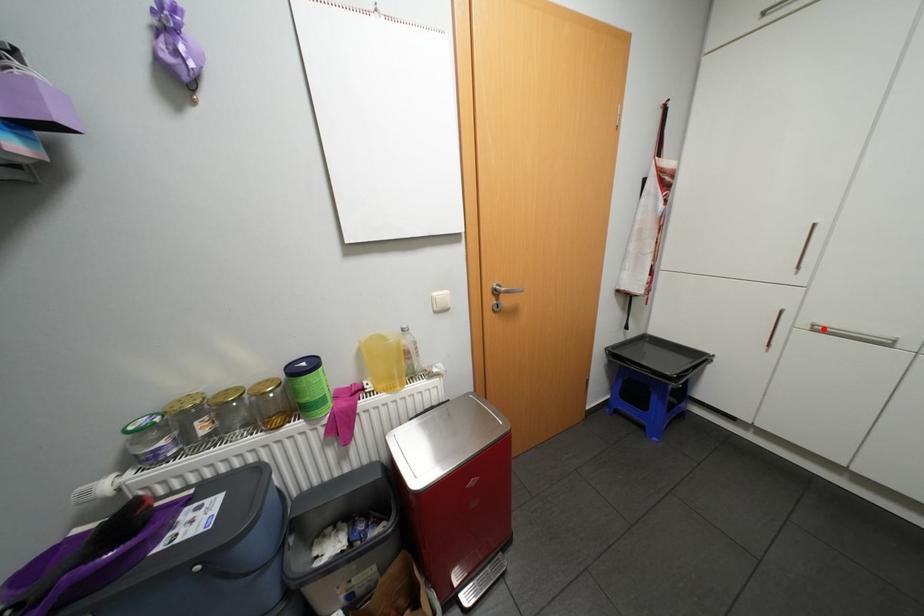
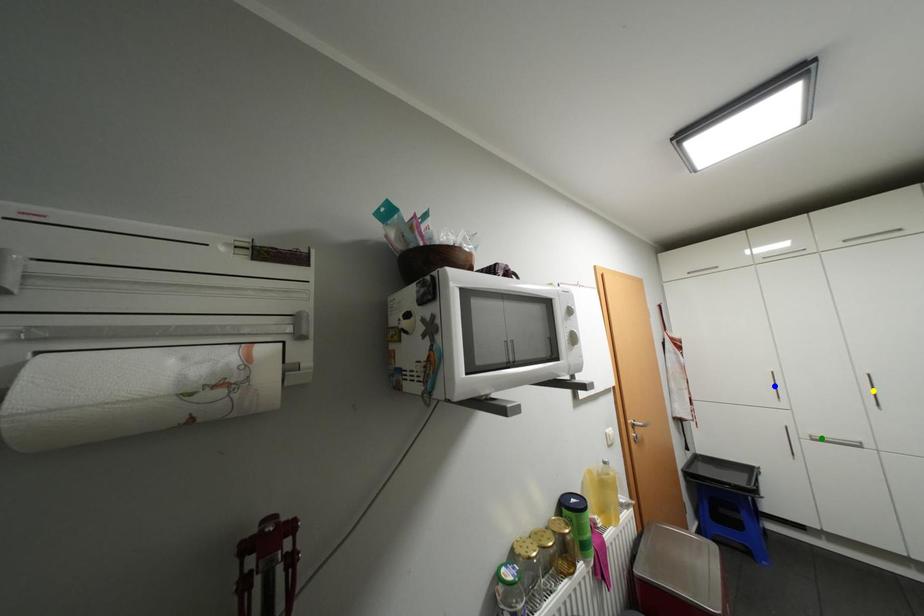
Question: I am providing you with two images of the same scene from different viewpoints. A red point is marked on the first image. You are given multiple points on the second image. Which mark in image 2 goes with the point in image 1?

Choices:
 (A) blue point
 (B) yellow point
 (C) green point

Answer: (C)